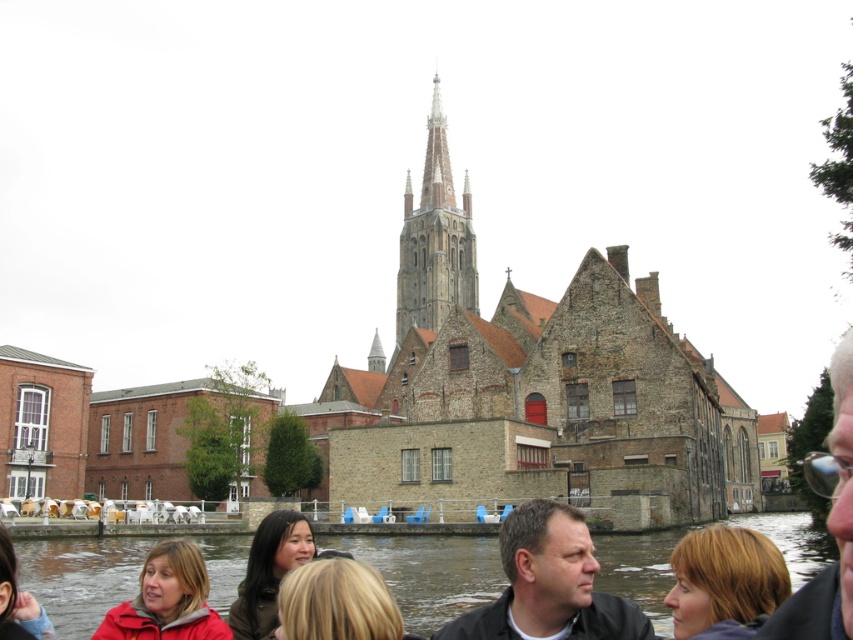
Question: Observing the image, what is the correct spatial positioning of blonde hair at lower center in reference to blonde hair at lower left?

Choices:
 (A) above
 (B) below

Answer: (A)

Question: Which object appears farthest from the camera in this image?

Choices:
 (A) blonde hair at lower center
 (B) dark gray jacket at center

Answer: (B)

Question: Among these points, which one is nearest to the camera?

Choices:
 (A) (282, 570)
 (B) (422, 216)
 (C) (140, 616)
 (D) (508, 532)

Answer: (D)

Question: Based on their relative distances, which object is nearer to the matte red jacket at lower left?

Choices:
 (A) blonde hair at lower right
 (B) blonde hair at lower center
 (C) clear water at lower center
 (D) blonde hair at lower left

Answer: (D)

Question: Can you confirm if clear water at lower center is thinner than brown stone tower at center?

Choices:
 (A) no
 (B) yes

Answer: (A)

Question: Does clear water at lower center appear on the right side of dark gray jacket at center?

Choices:
 (A) yes
 (B) no

Answer: (A)